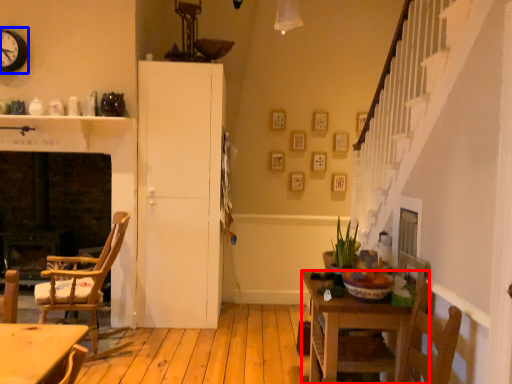
Question: Which object appears closest to the camera in this image, kitchen & dining room table (highlighted by a red box) or clock (highlighted by a blue box)?

Choices:
 (A) kitchen & dining room table
 (B) clock

Answer: (A)